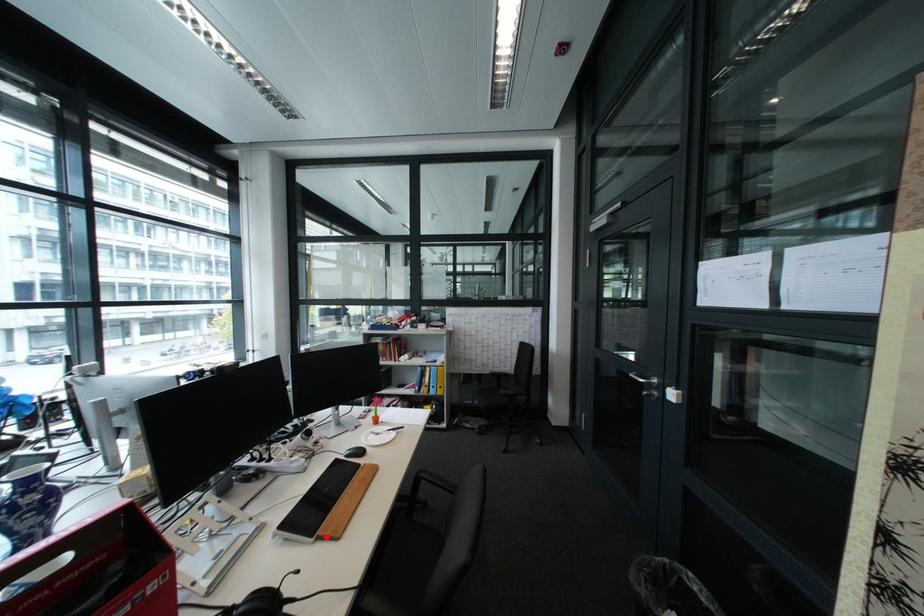
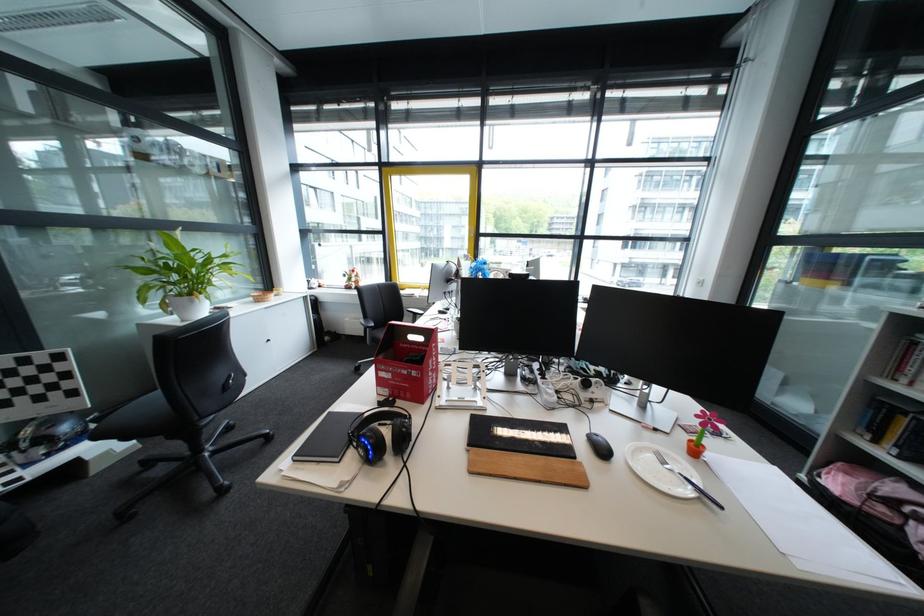
Where in the second image is the point corresponding to the highlighted location from the first image?

(481, 446)